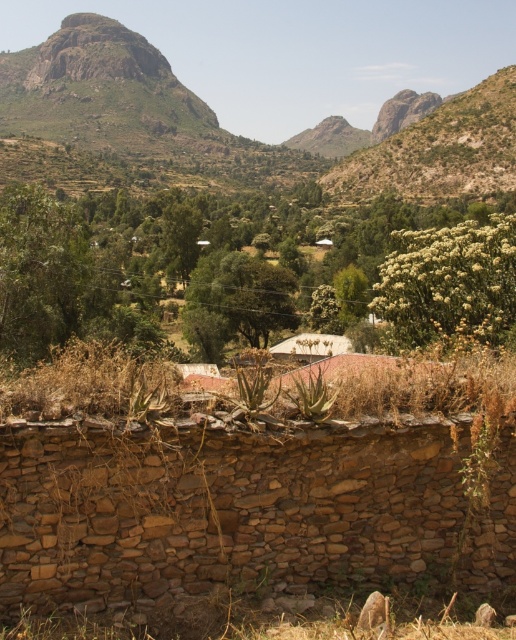
Does green leafy bush at center appear on the left side of white corrugated metal hut at center?

Indeed, green leafy bush at center is positioned on the left side of white corrugated metal hut at center.

Based on the photo, is green leafy bush at center behind white corrugated metal hut at center?

No, it is in front of white corrugated metal hut at center.

I want to click on green leafy bush at center, so click(192, 262).